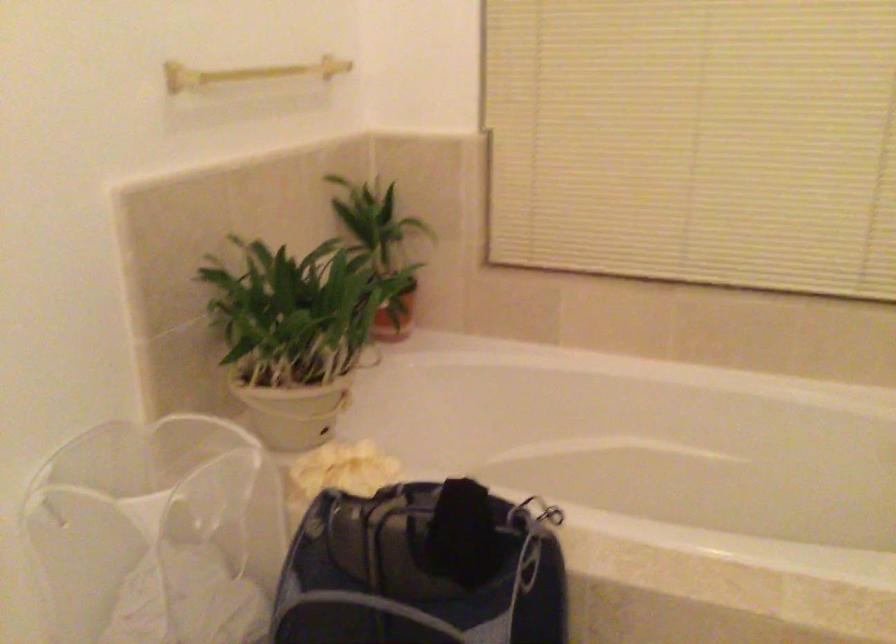
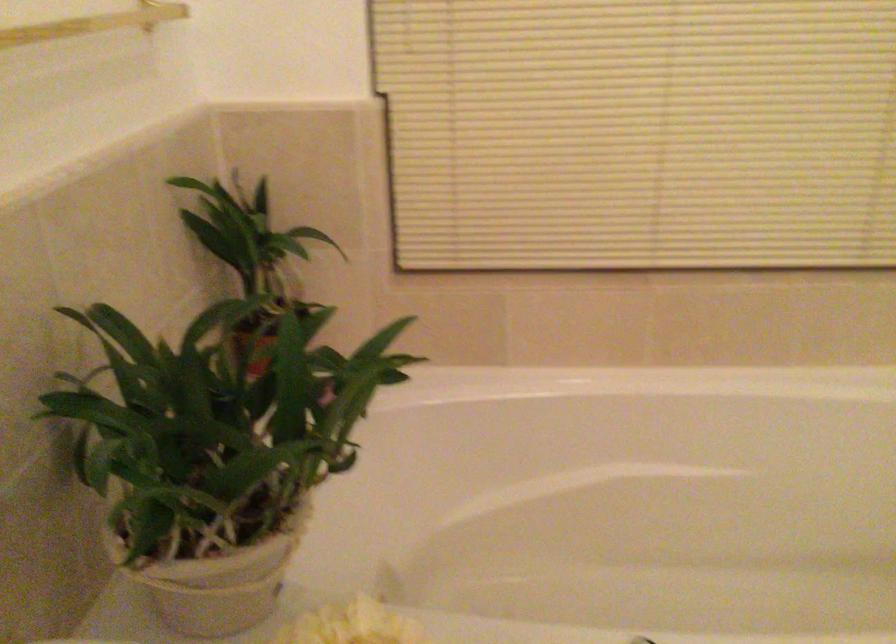
Locate, in the second image, the point that corresponds to [355,451] in the first image.

(351, 625)